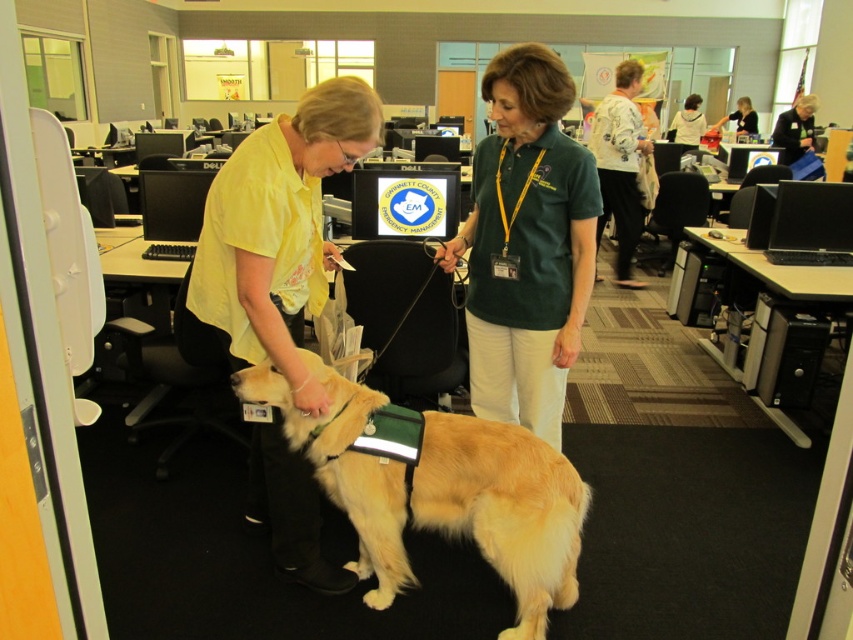
Does black shirt at upper right have a greater height compared to dark hair at center?

In fact, black shirt at upper right may be shorter than dark hair at center.

Is black shirt at upper right closer to camera compared to dark hair at center?

Yes, black shirt at upper right is closer to the viewer.

This screenshot has height=640, width=853. Describe the element at coordinates (795, 129) in the screenshot. I see `black shirt at upper right` at that location.

The width and height of the screenshot is (853, 640). I want to click on black shirt at upper right, so (x=795, y=129).

Who is shorter, golden fur dog at center or black shirt at upper right?

golden fur dog at center is shorter.

Can you confirm if golden fur dog at center is wider than black shirt at upper right?

No.

Is point (381, 595) positioned after point (773, 134)?

No.

Where is `golden fur dog at center`? The height and width of the screenshot is (640, 853). golden fur dog at center is located at coordinates click(x=505, y=508).

Is white textured shirt at upper center to the right of black shirt at upper right from the viewer's perspective?

In fact, white textured shirt at upper center is to the left of black shirt at upper right.

Identify the location of white textured shirt at upper center. The width and height of the screenshot is (853, 640). (619, 164).

Locate an element on the screen. white textured shirt at upper center is located at coordinates (619, 164).